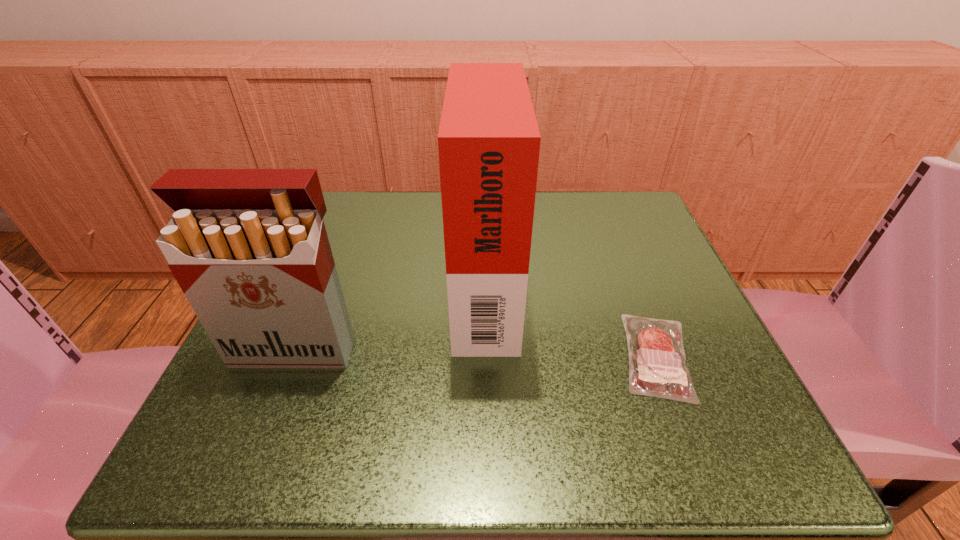
Locate an element on the screen. free space that satisfies the following two spatial constraints: 1. on the front-facing side of the rightmost object; 2. on the right side of the second object from left to right is located at coordinates (486, 356).

The height and width of the screenshot is (540, 960). What are the coordinates of `vacant space that satisfies the following two spatial constraints: 1. on the front-facing side of the rightmost object; 2. on the left side of the second object from left to right` in the screenshot? It's located at click(x=486, y=356).

Locate an element on the screen. Image resolution: width=960 pixels, height=540 pixels. vacant space that satisfies the following two spatial constraints: 1. on the front-facing side of the shortest object; 2. on the right side of the right cigarette case is located at coordinates (486, 356).

Locate an element on the screen. vacant space that satisfies the following two spatial constraints: 1. with the lid open on the steak; 2. on the right side of the left cigarette case is located at coordinates tap(292, 356).

Identify the location of vacant space that satisfies the following two spatial constraints: 1. on the front-facing side of the right cigarette case; 2. with the lid open on the leftmost object. (486, 348).

You are a GUI agent. You are given a task and a screenshot of the screen. Output one action in this format:
    pyautogui.click(x=<x>, y=<y>)
    Task: Click on the vacant point that satisfies the following two spatial constraints: 1. on the front-facing side of the taller cigarette case; 2. with the lid open on the left cigarette case
    Image resolution: width=960 pixels, height=540 pixels.
    Given the screenshot: What is the action you would take?
    pyautogui.click(x=486, y=348)